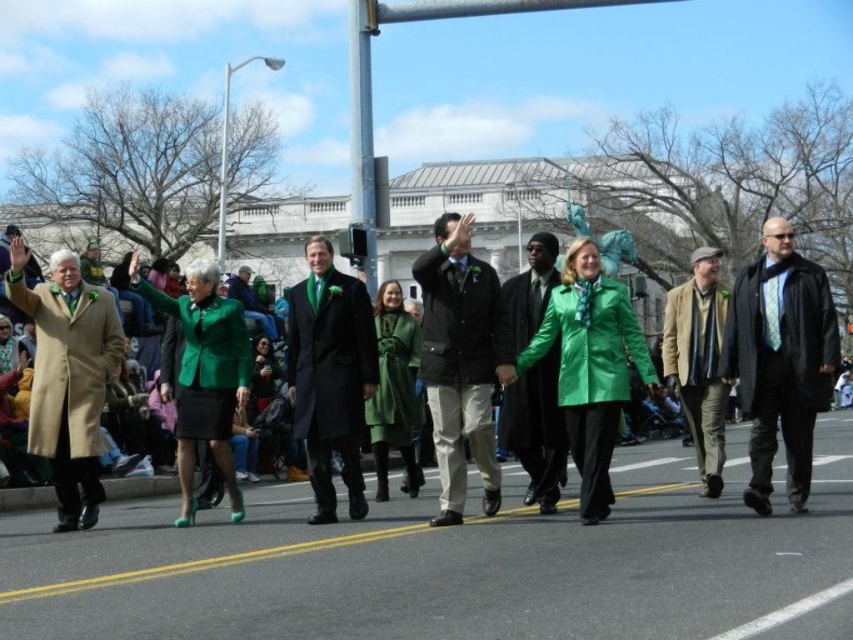
Can you confirm if matte beige coat at left is thinner than khaki cotton pants at center?

Yes, matte beige coat at left is thinner than khaki cotton pants at center.

Who is more forward, (102,406) or (699,371)?

Point (102,406) is more forward.

Locate an element on the screen. matte beige coat at left is located at coordinates (68, 378).

Between shiny black coat at center and green matte coat at center, which one appears on the right side from the viewer's perspective?

shiny black coat at center is more to the right.

Can you confirm if shiny black coat at center is thinner than green matte coat at center?

In fact, shiny black coat at center might be wider than green matte coat at center.

Does point (506, 429) come behind point (160, 481)?

That is False.

Locate an element on the screen. The image size is (853, 640). shiny black coat at center is located at coordinates (537, 429).

Is black matte coat at right taller than matte black jacket at center?

No, black matte coat at right is not taller than matte black jacket at center.

Who is lower down, black matte coat at right or matte black jacket at center?

matte black jacket at center is below.

Locate an element on the screen. The image size is (853, 640). black matte coat at right is located at coordinates (780, 358).